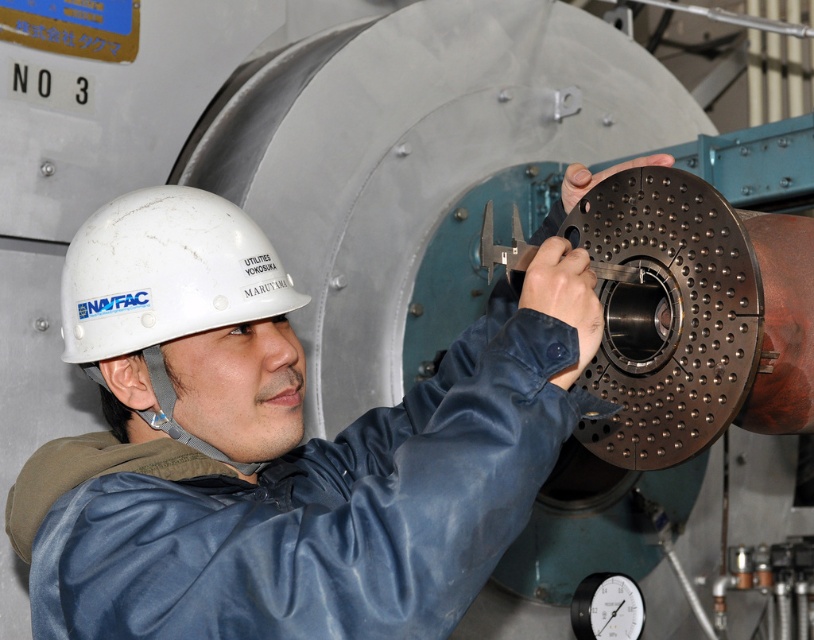
Question: Can you confirm if white matte hard hat at upper center is positioned to the left of white matte hard hat at center?

Choices:
 (A) no
 (B) yes

Answer: (A)

Question: Among these points, which one is farthest from the camera?

Choices:
 (A) (430, 484)
 (B) (215, 220)

Answer: (B)

Question: Which point is closer to the camera?

Choices:
 (A) (449, 513)
 (B) (213, 282)

Answer: (A)

Question: Does white matte hard hat at upper center lie behind white matte hard hat at center?

Choices:
 (A) yes
 (B) no

Answer: (B)

Question: Is white matte hard hat at upper center bigger than white matte hard hat at center?

Choices:
 (A) no
 (B) yes

Answer: (B)